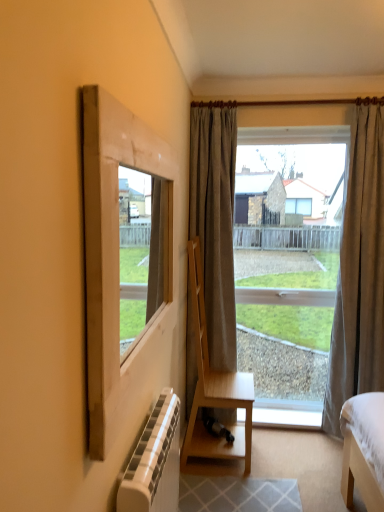
Question: Based on their sizes in the image, would you say clear glass window at center is bigger or smaller than matte gray curtain at right, positioned as the 2th curtain in left-to-right order?

Choices:
 (A) small
 (B) big

Answer: (A)

Question: Considering the positions of clear glass window at center and matte gray curtain at right, the first curtain positioned from the right, in the image, is clear glass window at center taller or shorter than matte gray curtain at right, the first curtain positioned from the right,?

Choices:
 (A) tall
 (B) short

Answer: (B)

Question: Which object is the farthest from the clear glass window at center?

Choices:
 (A) white textured radiator at lower left
 (B) light brown wooden chair at center
 (C) matte gray curtain at right, the first curtain positioned from the right
 (D) white painted wood at lower center
 (E) natural wood frame at left

Answer: (A)

Question: Which object is the closest to the matte gray curtain at right, the first curtain positioned from the right?

Choices:
 (A) white textured radiator at lower left
 (B) natural wood frame at left
 (C) white painted wood at lower center
 (D) clear glass window at center
 (E) gray fabric curtain at center, the 1th curtain positioned from the left

Answer: (D)